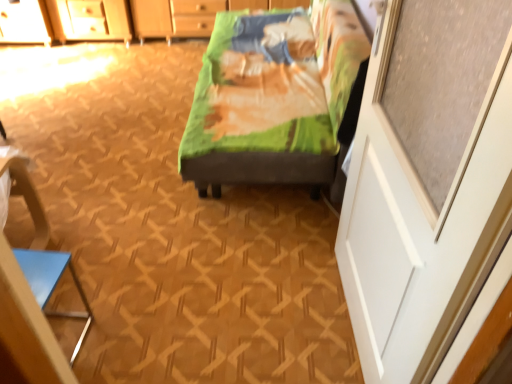
I want to click on vacant space in between blue glossy triangle at lower left and green fabric bed at center, so point(169,242).